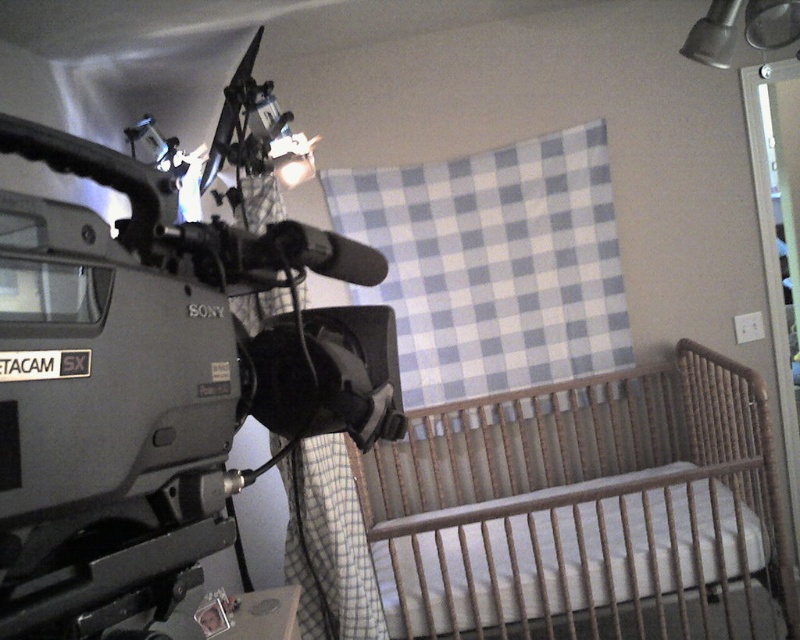
Describe the element at coordinates (154, 384) in the screenshot. This screenshot has width=800, height=640. I see `metallic gray video camera at left` at that location.

From the picture: Between metallic gray video camera at left and wooden crib at lower right, which one has less height?

metallic gray video camera at left is shorter.

Is point (240, 109) positioned after point (672, 536)?

Yes, point (240, 109) is behind point (672, 536).

What are the coordinates of `metallic gray video camera at left` in the screenshot? It's located at (154, 384).

Who is shorter, metallic gray video camera at left or wooden changing table at lower center?

wooden changing table at lower center is shorter.

Is point (348, 237) less distant than point (289, 588)?

No, (348, 237) is further to viewer.

What do you see at coordinates (154, 384) in the screenshot? This screenshot has width=800, height=640. I see `metallic gray video camera at left` at bounding box center [154, 384].

I want to click on metallic gray video camera at left, so click(x=154, y=384).

Which is in front, point (678, 452) or point (230, 618)?

Point (230, 618) is in front.

Can you confirm if wooden crib at lower right is shorter than wooden changing table at lower center?

No, wooden crib at lower right is not shorter than wooden changing table at lower center.

Between point (500, 627) and point (254, 609), which one is positioned behind?

Positioned behind is point (500, 627).

Where is `wooden crib at lower right`? wooden crib at lower right is located at coordinates (586, 512).